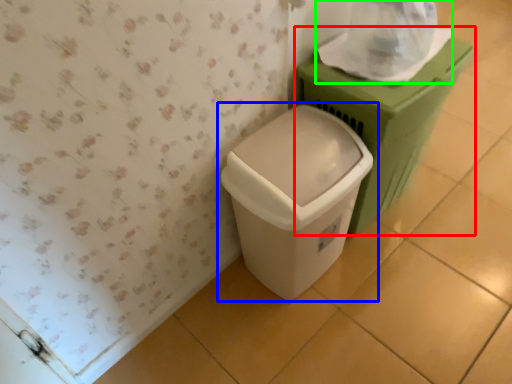
Question: Which object is positioned closest to waste container (highlighted by a red box)? Select from waste container (highlighted by a blue box) and toilet paper (highlighted by a green box).

Choices:
 (A) waste container
 (B) toilet paper

Answer: (B)